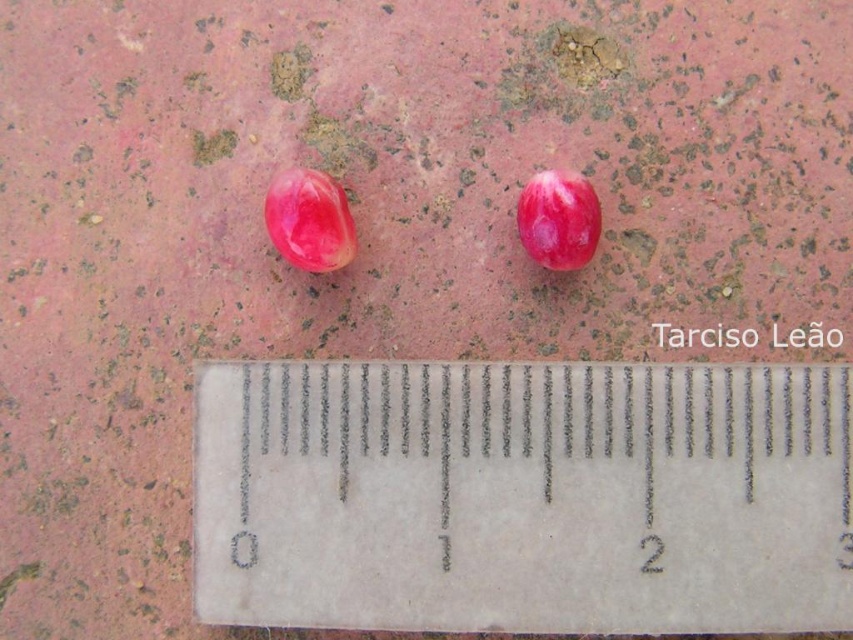
Who is positioned more to the right, transparent plastic ruler at center or glossy pink fruit at center?

glossy pink fruit at center

Image resolution: width=853 pixels, height=640 pixels. What are the coordinates of `transparent plastic ruler at center` in the screenshot? It's located at (524, 497).

Who is more distant from viewer, (326, 397) or (585, 216)?

Point (585, 216)

Image resolution: width=853 pixels, height=640 pixels. In order to click on transparent plastic ruler at center in this screenshot , I will do `click(524, 497)`.

Is transparent plastic ruler at center to the left of glossy pink seed at center from the viewer's perspective?

In fact, transparent plastic ruler at center is to the right of glossy pink seed at center.

Does transparent plastic ruler at center have a lesser width compared to glossy pink seed at center?

In fact, transparent plastic ruler at center might be wider than glossy pink seed at center.

Between point (432, 561) and point (289, 244), which one is positioned behind?

The point (289, 244) is behind.

Find the location of a particular element. The image size is (853, 640). transparent plastic ruler at center is located at coordinates (524, 497).

Looking at this image, between glossy pink seed at center and glossy pink fruit at center, which one has less height?

glossy pink fruit at center

From the picture: Is glossy pink seed at center above glossy pink fruit at center?

Actually, glossy pink seed at center is below glossy pink fruit at center.

The height and width of the screenshot is (640, 853). Find the location of `glossy pink seed at center`. glossy pink seed at center is located at coordinates (309, 220).